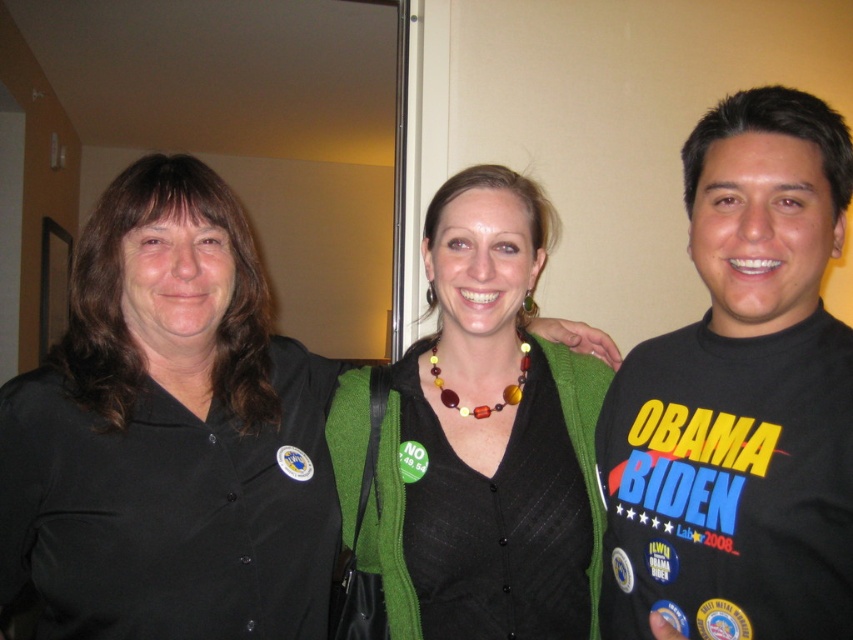
Question: Is black t-shirt at right below multicolored beads necklace at center?

Choices:
 (A) yes
 (B) no

Answer: (A)

Question: Which point is farther to the camera?

Choices:
 (A) (270, 486)
 (B) (503, 621)

Answer: (A)

Question: Among these objects, which one is farthest from the camera?

Choices:
 (A) black t-shirt at right
 (B) green fabric sweater at center
 (C) black matte shirt at center
 (D) multicolored beads necklace at center

Answer: (D)

Question: Which point is closer to the camera?

Choices:
 (A) multicolored beads necklace at center
 (B) black matte shirt at center

Answer: (B)

Question: Does black t-shirt at right lie behind green fabric sweater at center?

Choices:
 (A) yes
 (B) no

Answer: (B)

Question: Does black t-shirt at right appear on the right side of multicolored beads necklace at center?

Choices:
 (A) no
 (B) yes

Answer: (B)